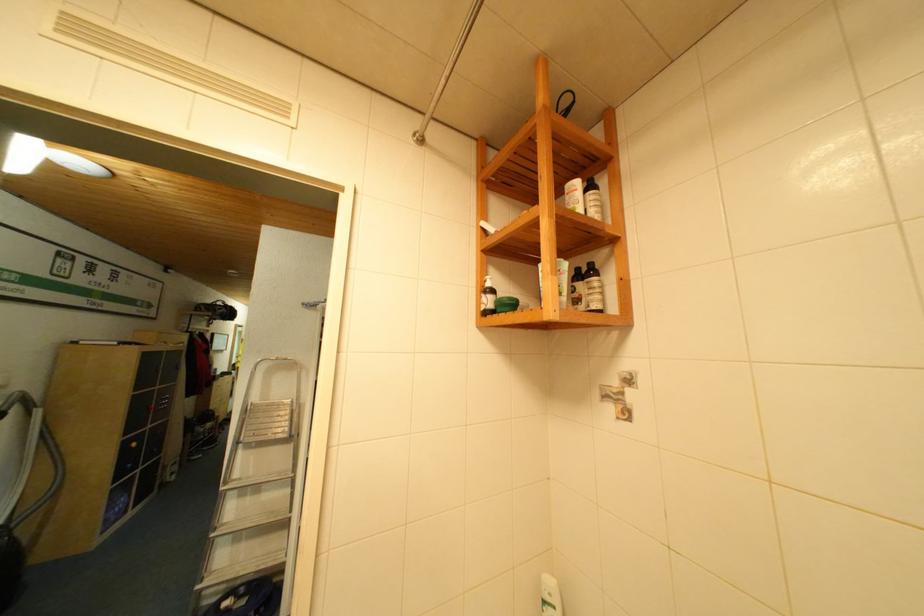
Find where to turn the metal wall fixture. Please return your answer as a coordinate pair (x, y).

(30, 459)